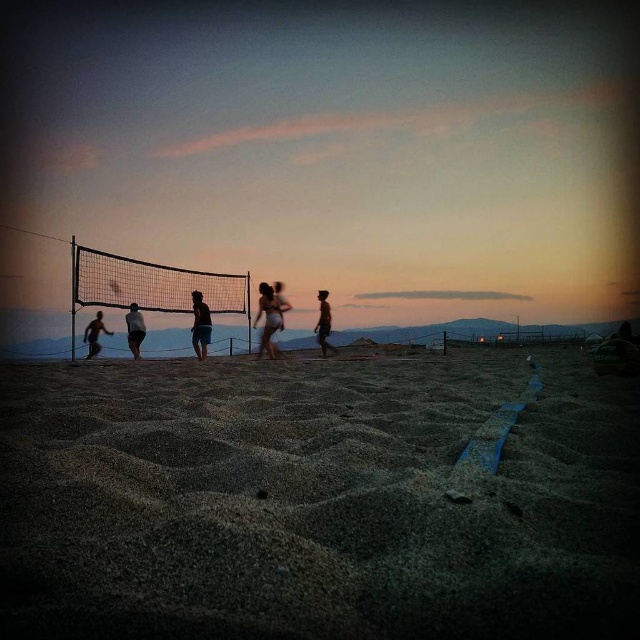
Question: Which of these objects is positioned closest to the dark brown sand at lower center?

Choices:
 (A) dark silhouette person at left
 (B) silhouette sand volleyball player at center
 (C) silhouette figure at center

Answer: (C)

Question: Is dark blue shorts at center positioned behind dark silhouette person at left?

Choices:
 (A) no
 (B) yes

Answer: (A)

Question: Does dark silhouette person at left appear on the right side of smooth skin figure at center?

Choices:
 (A) yes
 (B) no

Answer: (B)

Question: Which object is the farthest from the smooth white bikini at center?

Choices:
 (A) dark silhouette person at left
 (B) silhouette figure at center

Answer: (A)

Question: In this image, where is smooth white bikini at center located relative to silhouette figure at center?

Choices:
 (A) left
 (B) right

Answer: (A)

Question: Considering the real-world distances, which object is closest to the dark silhouette person at left?

Choices:
 (A) smooth white bikini at center
 (B) silhouette sand volleyball player at center
 (C) smooth skin figure at center

Answer: (B)